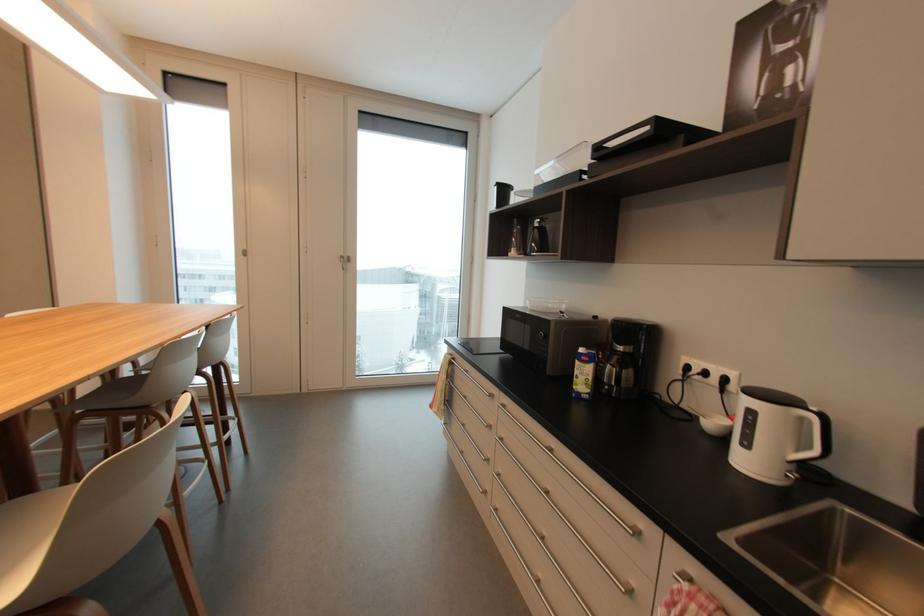
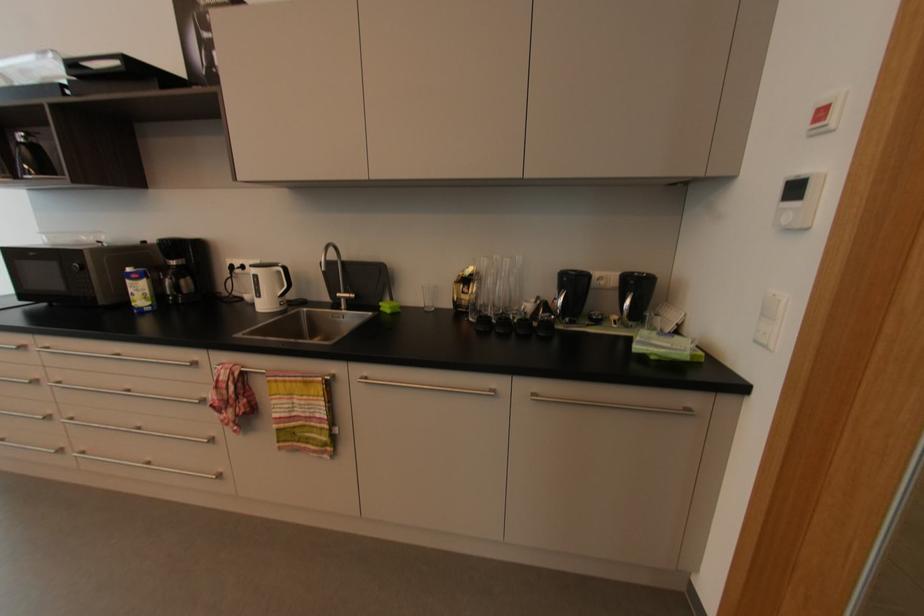
In the second image, find the point that corresponds to pixel 808 419 in the first image.

(282, 273)